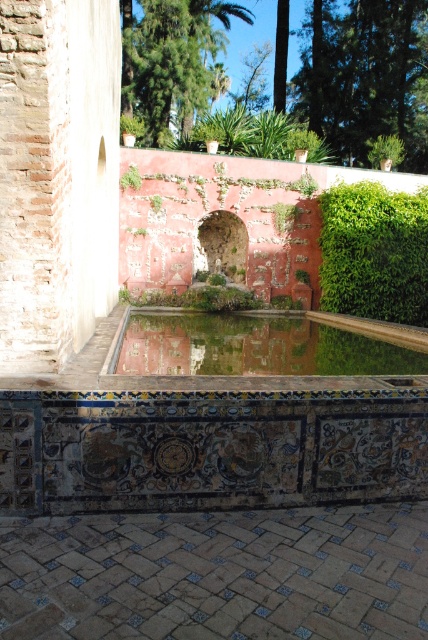
Question: Which is nearer to the green leafy palm tree at upper center?

Choices:
 (A) green mossy pool at center
 (B) decorative tile ledge at center
 (C) green leafy hedge at right

Answer: (C)

Question: Estimate the real-world distances between objects in this image. Which object is closer to the green mossy pool at center?

Choices:
 (A) green leafy hedge at right
 (B) decorative tile ledge at center
 (C) green leafy palm tree at upper center

Answer: (B)

Question: Is green mossy pool at center closer to camera compared to green leafy palm tree at upper center?

Choices:
 (A) no
 (B) yes

Answer: (B)

Question: Can you confirm if green mossy pool at center is bigger than green leafy palm tree at upper center?

Choices:
 (A) yes
 (B) no

Answer: (B)

Question: Which point is farther to the camera?

Choices:
 (A) decorative tile ledge at center
 (B) green leafy palm tree at upper center

Answer: (B)

Question: Can you confirm if decorative tile ledge at center is bigger than green leafy hedge at right?

Choices:
 (A) yes
 (B) no

Answer: (B)